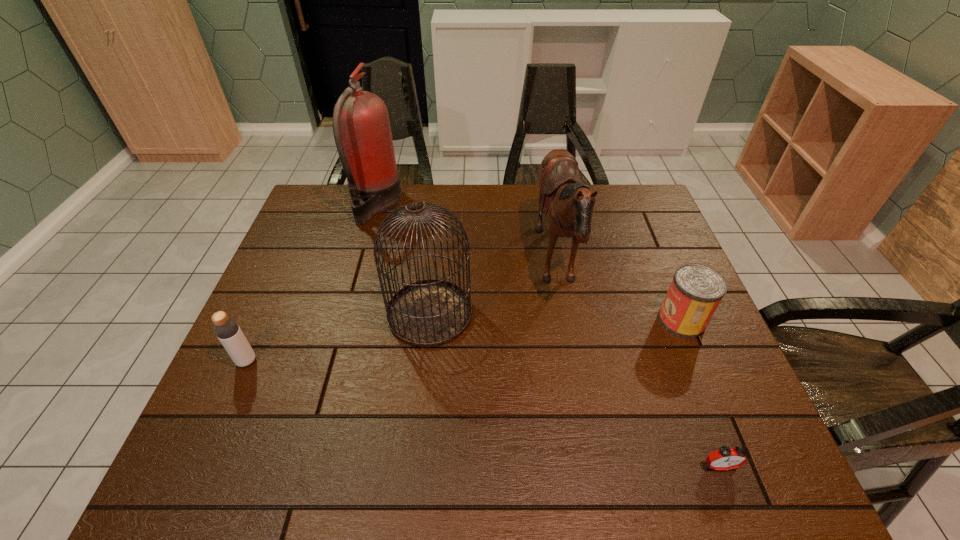
Locate an element on the screen. can present at the right edge is located at coordinates (696, 290).

Locate an element on the screen. alarm clock situated at the right edge is located at coordinates (725, 458).

The height and width of the screenshot is (540, 960). I want to click on object that is positioned at the far left corner, so click(x=361, y=127).

Find the location of a particular element. The width and height of the screenshot is (960, 540). object located at the near right corner is located at coordinates (725, 458).

Where is `vacant space at the far edge of the desktop`? The image size is (960, 540). vacant space at the far edge of the desktop is located at coordinates (425, 200).

I want to click on vacant position at the near edge of the desktop, so click(675, 455).

You are a GUI agent. You are given a task and a screenshot of the screen. Output one action in this format:
    pyautogui.click(x=<x>, y=<y>)
    Task: Click on the free space at the left edge
    This screenshot has width=960, height=540.
    Given the screenshot: What is the action you would take?
    pyautogui.click(x=317, y=254)

The width and height of the screenshot is (960, 540). In the image, there is a desktop. Identify the location of vacant space at the right edge. (692, 347).

At what (x,y) coordinates should I click in order to perform the action: click on vacant area at the far left corner. Please return your answer as a coordinate pair (x, y). Looking at the image, I should click on (316, 188).

What are the coordinates of `vacant space at the near left corner of the desktop` in the screenshot? It's located at (238, 449).